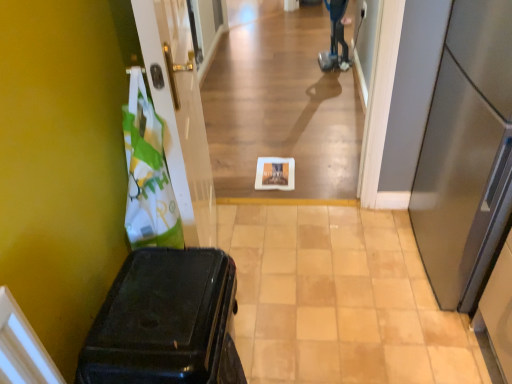
The image size is (512, 384). Find the location of `free spot below white paper at center (from a real-world perspective)`. free spot below white paper at center (from a real-world perspective) is located at coordinates (286, 195).